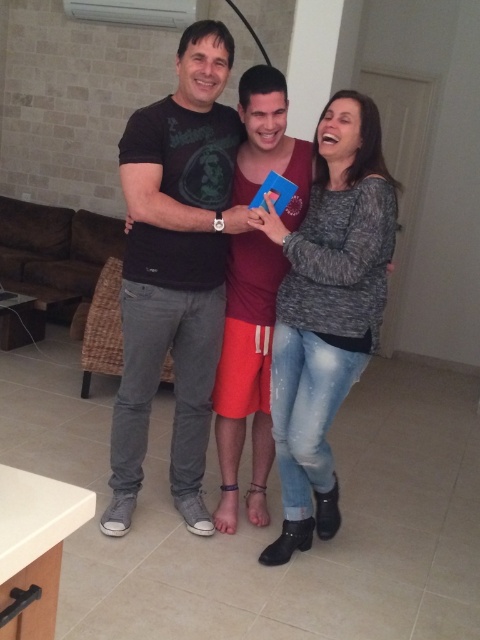
Question: Can you confirm if black matte t-shirt at center is positioned below gray knit sweater at center?

Choices:
 (A) no
 (B) yes

Answer: (A)

Question: Which is farther from the black matte t-shirt at center?

Choices:
 (A) matte red shorts at center
 (B) gray knit sweater at center
 (C) matte black shirt at center

Answer: (B)

Question: Which of these objects is positioned farthest from the gray knit sweater at center?

Choices:
 (A) matte red shorts at center
 (B) matte black shirt at center
 (C) black matte t-shirt at center

Answer: (C)

Question: From the image, what is the correct spatial relationship of matte black shirt at center in relation to matte red shorts at center?

Choices:
 (A) right
 (B) left

Answer: (A)

Question: Among these objects, which one is farthest from the camera?

Choices:
 (A) matte black shirt at center
 (B) gray knit sweater at center
 (C) black matte t-shirt at center

Answer: (C)

Question: From the image, what is the correct spatial relationship of black matte t-shirt at center in relation to matte red shorts at center?

Choices:
 (A) below
 (B) above

Answer: (B)